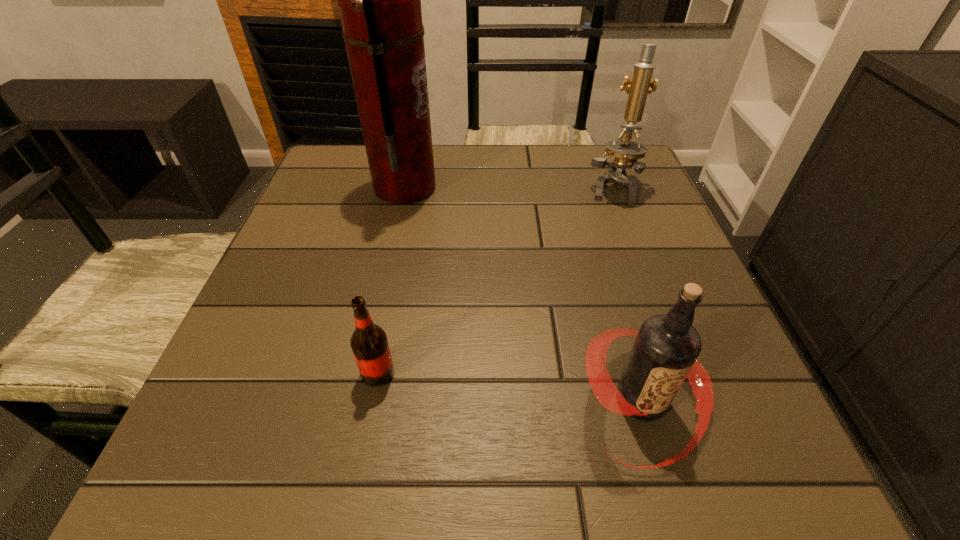
Locate an element on the screen. This screenshot has height=540, width=960. free space at the left edge is located at coordinates pyautogui.click(x=298, y=328).

The image size is (960, 540). What are the coordinates of `vacant space at the right edge of the desktop` in the screenshot? It's located at tap(709, 344).

At what (x,y) coordinates should I click in order to perform the action: click on free region at the far left corner. Please return your answer as a coordinate pair (x, y). Looking at the image, I should click on (337, 166).

This screenshot has height=540, width=960. Identify the location of vacant space at the far right corner of the desktop. (593, 185).

Locate an element on the screen. The width and height of the screenshot is (960, 540). empty space that is in between the taller root beer and the shorter root beer is located at coordinates (510, 387).

The width and height of the screenshot is (960, 540). Identify the location of empty space that is in between the right root beer and the tallest object. pos(523,294).

At what (x,y) coordinates should I click in order to perform the action: click on vacant area that lies between the third shortest object and the taller root beer. Please return your answer as a coordinate pair (x, y). The image size is (960, 540). Looking at the image, I should click on (627, 294).

Locate an element on the screen. Image resolution: width=960 pixels, height=540 pixels. free point between the fire extinguisher and the third tallest object is located at coordinates (523, 294).

At what (x,y) coordinates should I click in order to perform the action: click on free space between the fire extinguisher and the microscope. Please return your answer as a coordinate pair (x, y). The width and height of the screenshot is (960, 540). Looking at the image, I should click on (508, 188).

At what (x,y) coordinates should I click in order to perform the action: click on empty space that is in between the tallest object and the second tallest object. Please return your answer as a coordinate pair (x, y). Image resolution: width=960 pixels, height=540 pixels. Looking at the image, I should click on (508, 188).